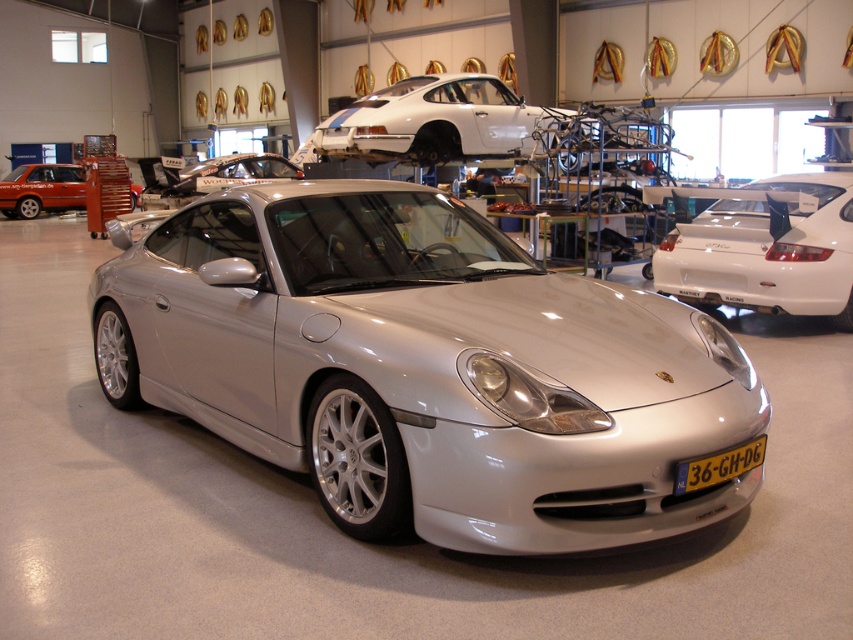
You are a mechanic working in the garage. You need to place a new license plate holder on the silver metallic car at center. The holder requires that the license plate must not be taller than the car itself. Will the yellow plastic license plate at center fit properly on the holder?

The silver metallic car at center has a greater height compared to the yellow plastic license plate at center, so the license plate will fit properly on the holder since it is shorter than the car.

You are standing in the garage and need to locate the silver metallic car at center. According to the coordinates provided, where exactly is it positioned?

The silver metallic car at center is positioned at the coordinates point (425, 369).

You are a technician in the garage and need to access two points for maintenance. The first point is at coordinate point(656,502) and the second is at point(77,188). Which point is closer to you?

Point(656,502) is closer to the camera than point(77,188), so the first point is closer to you.